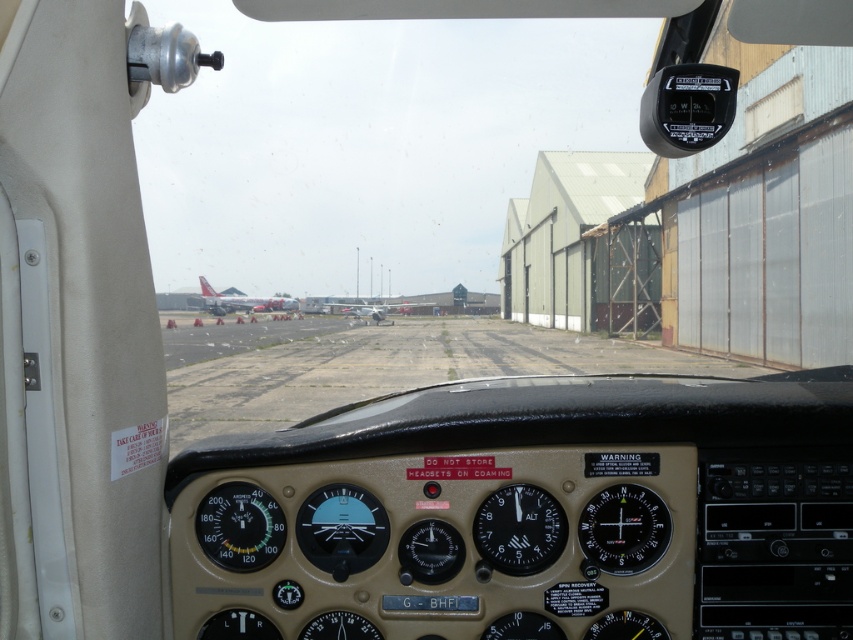
You are a pilot preparing for takeoff and notice two objects in your cockpit. You need to identify which one is smaller. Which object is smaller between the black plastic compass at center and the silver metallic airplane at center?

The black plastic compass at center is smaller than the silver metallic airplane at center.

You are a pilot preparing for takeoff and need to check the instruments on the dashboard. Which instrument is bigger between the black plastic compass at center and the black plastic altimeter at center?

The black plastic compass at center is larger in size than the black plastic altimeter at center.

You are a pilot preparing for takeoff and notice the black plastic compass at center and the silver metallic airplane at center on the cockpit dashboard. Which object is shorter in height?

The black plastic compass at center is not as tall as the silver metallic airplane at center, so the black plastic compass at center is shorter in height.